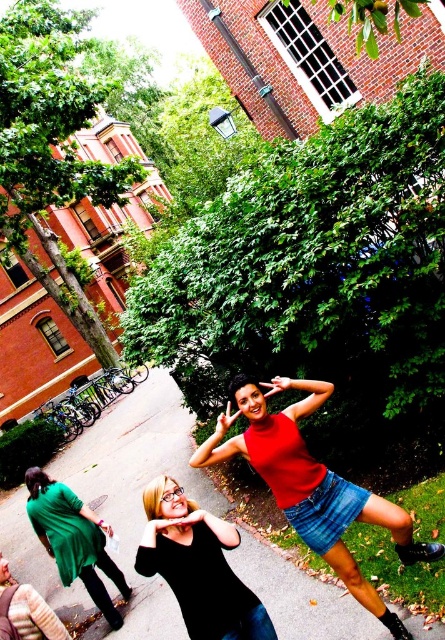
The image size is (445, 640). What are the coordinates of `matte red tank top at center` in the screenshot? It's located at (311, 484).

Does black matte t-shirt at center appear on the right side of green matte dress at lower left?

Yes, black matte t-shirt at center is to the right of green matte dress at lower left.

Identify the location of black matte t-shirt at center. The width and height of the screenshot is (445, 640). (198, 566).

Is matte red tank top at center further to camera compared to green matte dress at lower left?

No.

Can you confirm if matte red tank top at center is taller than green matte dress at lower left?

Correct, matte red tank top at center is much taller as green matte dress at lower left.

Does point (323, 552) come in front of point (36, 508)?

Yes, it is.

Identify the location of matte red tank top at center. This screenshot has width=445, height=640. (311, 484).